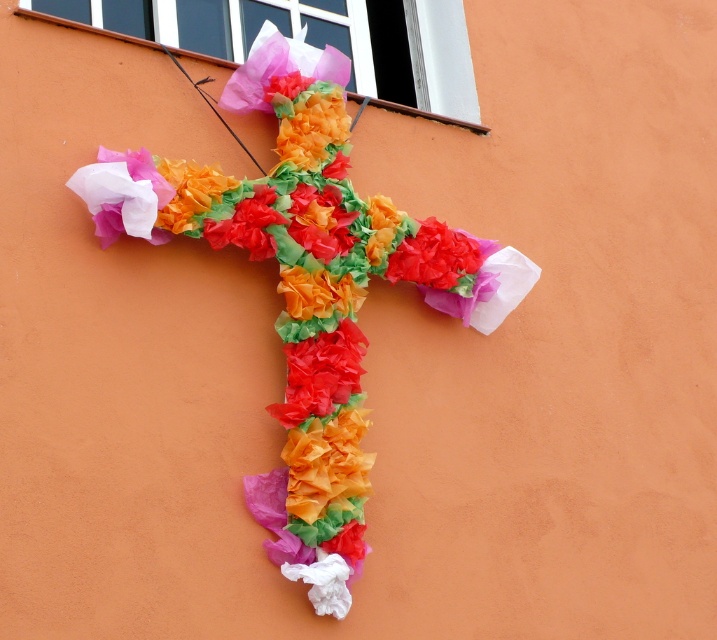
You are an interior designer who wants to ensure that two decorative items, the tissue paper cross at center and the matte paper flower at center, are spaced appropriately for visual balance. According to standard design principles, items should be at least 12 inches apart to avoid clutter. Does the current spacing between them meet this requirement?

The distance between the tissue paper cross at center and the matte paper flower at center is 14.57 inches, which exceeds the minimum requirement of 12 inches. Therefore, the spacing meets the standard design principle for visual balance.

You are an artist trying to install a new decoration on the wall. You have two points marked on the wall at coordinates point (294, 547) and point (436, 221). If you want to place a new decoration in front of the existing cross, which point should you choose?

Point (294, 547) is in front of point (436, 221), so you should choose point (294, 547) to place the new decoration in front of the existing cross.